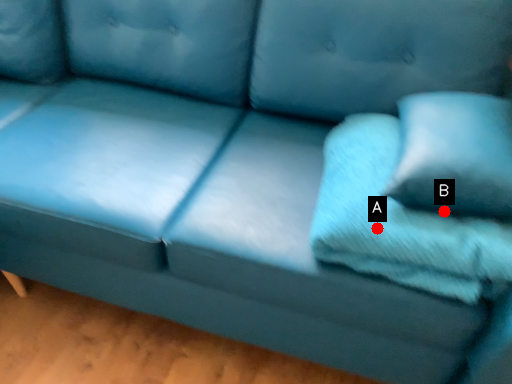
Question: Two points are circled on the image, labeled by A and B beside each circle. Which point is farther from the camera taking this photo?

Choices:
 (A) A is further
 (B) B is further

Answer: (B)